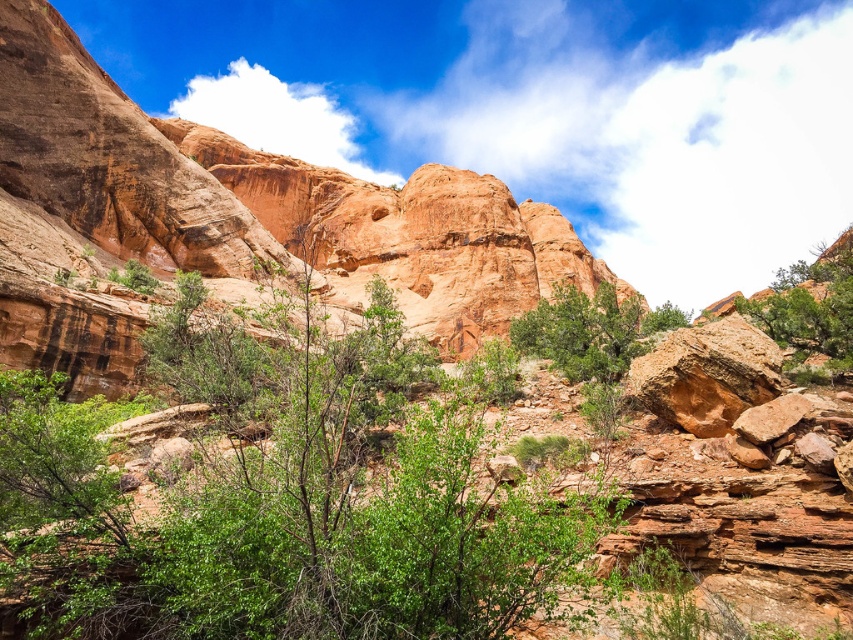
Between green leafy tree at center and green leafy tree at right, which one appears on the left side from the viewer's perspective?

Positioned to the left is green leafy tree at center.

Describe the element at coordinates (283, 492) in the screenshot. I see `green leafy tree at center` at that location.

Image resolution: width=853 pixels, height=640 pixels. What are the coordinates of `green leafy tree at center` in the screenshot? It's located at (283, 492).

Who is lower down, green leafy tree at center or green matte tree at center?

green leafy tree at center

Does point (463, 554) come in front of point (631, 344)?

Yes, it is.

Find the location of a particular element. The image size is (853, 640). green leafy tree at center is located at coordinates (283, 492).

Who is more forward, [787,305] or [563,285]?

Point [787,305] is more forward.

Between green leafy tree at right and green matte tree at center, which one has more height?

green leafy tree at right

Which is in front, point (805, 276) or point (575, 305)?

Point (575, 305) is in front.

Image resolution: width=853 pixels, height=640 pixels. What are the coordinates of `green leafy tree at right` in the screenshot? It's located at (810, 307).